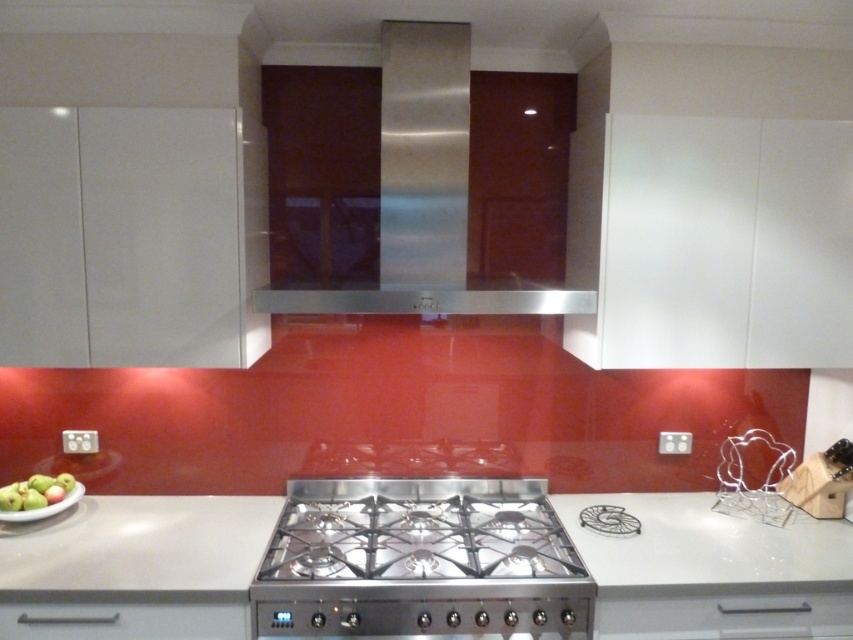
Question: Can you confirm if stainless steel gas stove at center is bigger than stainless steel exhaust hood at center?

Choices:
 (A) yes
 (B) no

Answer: (B)

Question: Which point is farther to the camera?

Choices:
 (A) satin white countertop at center
 (B) green matte apple at lower left
 (C) stainless steel gas stove at center

Answer: (B)

Question: Which of the following is the closest to the observer?

Choices:
 (A) (537, 554)
 (B) (32, 483)
 (C) (425, 52)
 (D) (767, 596)

Answer: (D)

Question: Which object is positioned closest to the stainless steel exhaust hood at center?

Choices:
 (A) stainless steel gas stove at center
 (B) satin white countertop at center

Answer: (A)

Question: Is stainless steel gas stove at center smaller than stainless steel exhaust hood at center?

Choices:
 (A) no
 (B) yes

Answer: (B)

Question: Can you confirm if stainless steel gas stove at center is thinner than green matte apple at lower left?

Choices:
 (A) yes
 (B) no

Answer: (B)